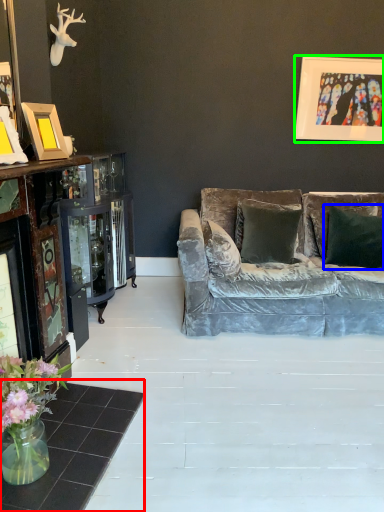
Question: Estimate the real-world distances between objects in this image. Which object is farther from table (highlighted by a red box), pillow (highlighted by a blue box) or picture frame (highlighted by a green box)?

Choices:
 (A) pillow
 (B) picture frame

Answer: (B)